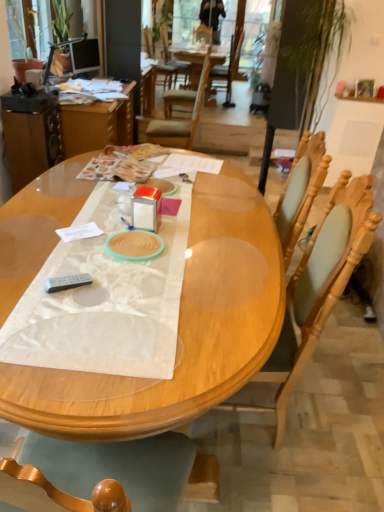
Question: From a real-world perspective, is wooden table at left positioned over green leafy plant at upper left, which is counted as the 1th houseplant, starting from the front, based on gravity?

Choices:
 (A) no
 (B) yes

Answer: (A)

Question: Is wooden table at left turned away from green leafy plant at upper left, which is counted as the 1th houseplant, starting from the front?

Choices:
 (A) no
 (B) yes

Answer: (A)

Question: Can you confirm if wooden table at left is wider than green leafy plant at upper left, which ranks as the 2th houseplant in back-to-front order?

Choices:
 (A) yes
 (B) no

Answer: (A)

Question: From a real-world perspective, is wooden table at left beneath green leafy plant at upper left, which is counted as the 1th houseplant, starting from the front?

Choices:
 (A) yes
 (B) no

Answer: (A)

Question: Considering the relative sizes of wooden table at left and green leafy plant at upper left, which ranks as the 2th houseplant in back-to-front order, in the image provided, is wooden table at left shorter than green leafy plant at upper left, which ranks as the 2th houseplant in back-to-front order,?

Choices:
 (A) yes
 (B) no

Answer: (B)

Question: From a real-world perspective, is wooden table at left physically located above or below wooden chair at center, the first chair positioned from the back?

Choices:
 (A) below
 (B) above

Answer: (A)

Question: Is wooden table at left wider or thinner than wooden chair at center, the second chair viewed from the front?

Choices:
 (A) thin
 (B) wide

Answer: (B)

Question: In terms of height, does wooden table at left look taller or shorter compared to wooden chair at center, which is the second chair from bottom to top?

Choices:
 (A) short
 (B) tall

Answer: (A)

Question: Do you think wooden table at left is within wooden chair at center, the second chair viewed from the front, or outside of it?

Choices:
 (A) inside
 (B) outside

Answer: (B)

Question: From the image's perspective, is matte black monitor at upper left positioned above or below white satin table runner at center?

Choices:
 (A) above
 (B) below

Answer: (A)

Question: Is point (69, 48) positioned closer to the camera than point (180, 240)?

Choices:
 (A) farther
 (B) closer

Answer: (A)

Question: From a real-world perspective, is matte black monitor at upper left above or below white satin table runner at center?

Choices:
 (A) above
 (B) below

Answer: (A)

Question: Is matte black monitor at upper left spatially inside white satin table runner at center, or outside of it?

Choices:
 (A) outside
 (B) inside

Answer: (A)

Question: From a real-world perspective, relative to wooden table at left, is white satin table runner at center vertically above or below?

Choices:
 (A) above
 (B) below

Answer: (A)

Question: Relative to wooden table at left, is white satin table runner at center in front or behind?

Choices:
 (A) front
 (B) behind

Answer: (A)